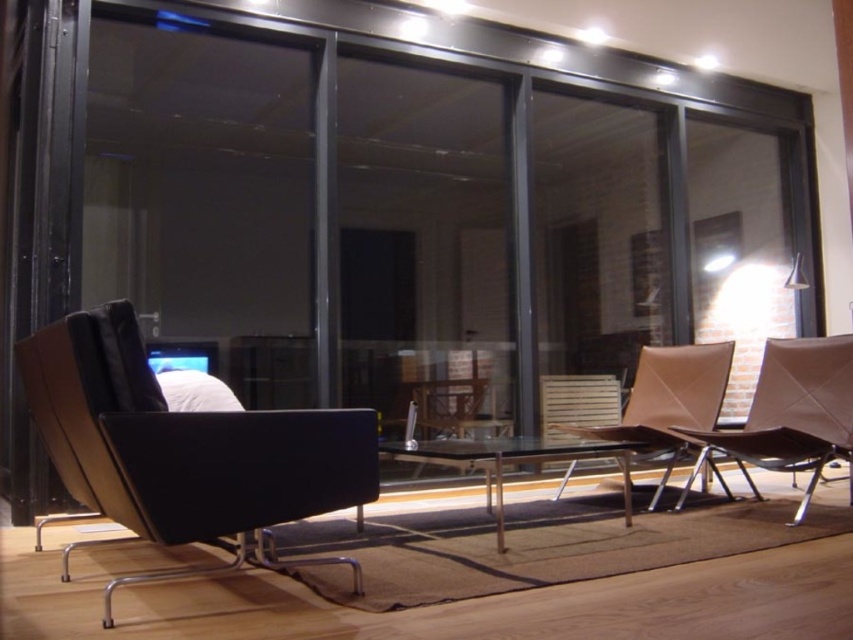
Question: Which point is farther from the camera taking this photo?

Choices:
 (A) (662, 442)
 (B) (555, 444)
 (C) (822, 410)
 (D) (271, 557)

Answer: (A)

Question: Can you confirm if leather textured chair at center is positioned above transparent glass table at center?

Choices:
 (A) no
 (B) yes

Answer: (B)

Question: Does black leather swivel chair at left lie behind transparent glass table at center?

Choices:
 (A) yes
 (B) no

Answer: (B)

Question: Among these objects, which one is nearest to the camera?

Choices:
 (A) brown leather chair at lower right
 (B) black leather swivel chair at left
 (C) leather textured chair at center
 (D) transparent glass table at center

Answer: (B)

Question: Estimate the real-world distances between objects in this image. Which object is farther from the black leather swivel chair at left?

Choices:
 (A) brown leather chair at lower right
 (B) leather textured chair at center

Answer: (A)

Question: Is black leather swivel chair at left wider than leather textured chair at center?

Choices:
 (A) yes
 (B) no

Answer: (A)